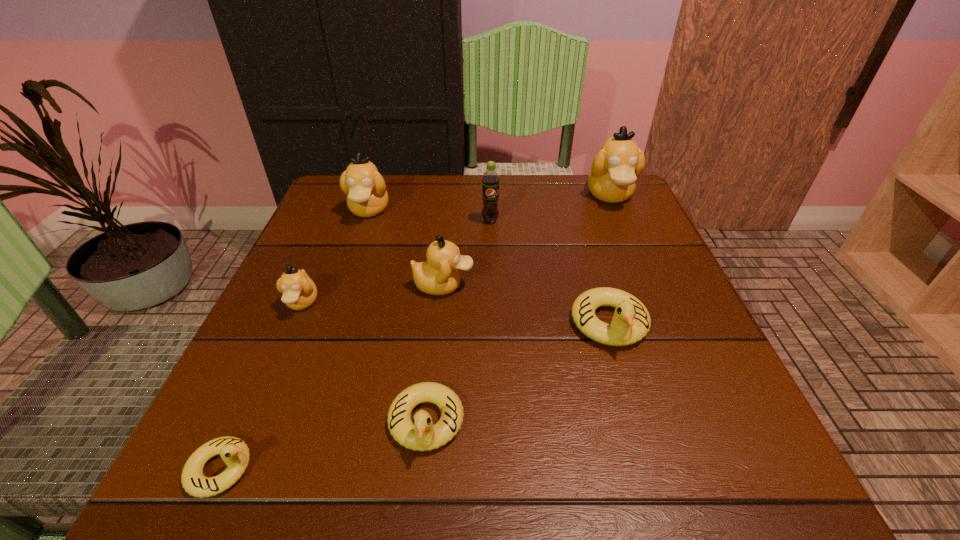
What are the coordinates of `vacant space situated 0.170m on the face of the leftmost yellow duckling` in the screenshot? It's located at (382, 469).

Where is `soda located in the far edge section of the desktop`? soda located in the far edge section of the desktop is located at coordinates (490, 181).

In order to click on object positioned at the far left corner in this screenshot , I will do `click(365, 188)`.

The height and width of the screenshot is (540, 960). I want to click on object that is at the near left corner, so click(x=234, y=452).

This screenshot has height=540, width=960. Identify the location of object that is at the far right corner. tap(614, 171).

This screenshot has height=540, width=960. Find the location of `free region at the far edge of the desktop`. free region at the far edge of the desktop is located at coordinates (514, 184).

In the image, there is a desktop. At what (x,y) coordinates should I click in order to perform the action: click on vacant space at the left edge. Please return your answer as a coordinate pair (x, y). The height and width of the screenshot is (540, 960). Looking at the image, I should click on (297, 253).

In the image, there is a desktop. In order to click on vacant space at the right edge in this screenshot , I will do `click(612, 274)`.

Find the location of a particular element. vacant region at the far left corner of the desktop is located at coordinates (376, 222).

What are the coordinates of `vacant space at the far right corner of the desktop` in the screenshot? It's located at (576, 192).